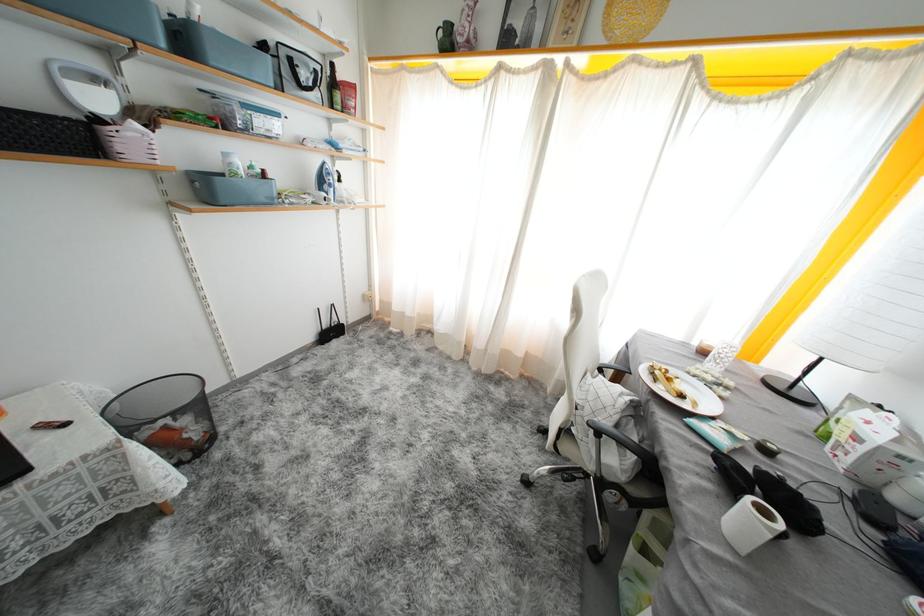
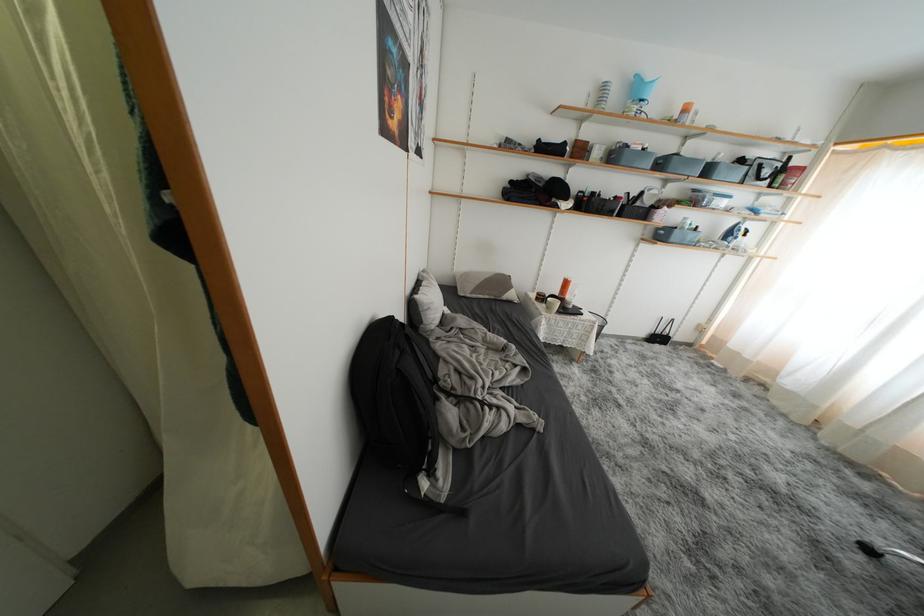
Find the pixel in the second image that matches (x=533, y=487) in the first image.

(876, 554)